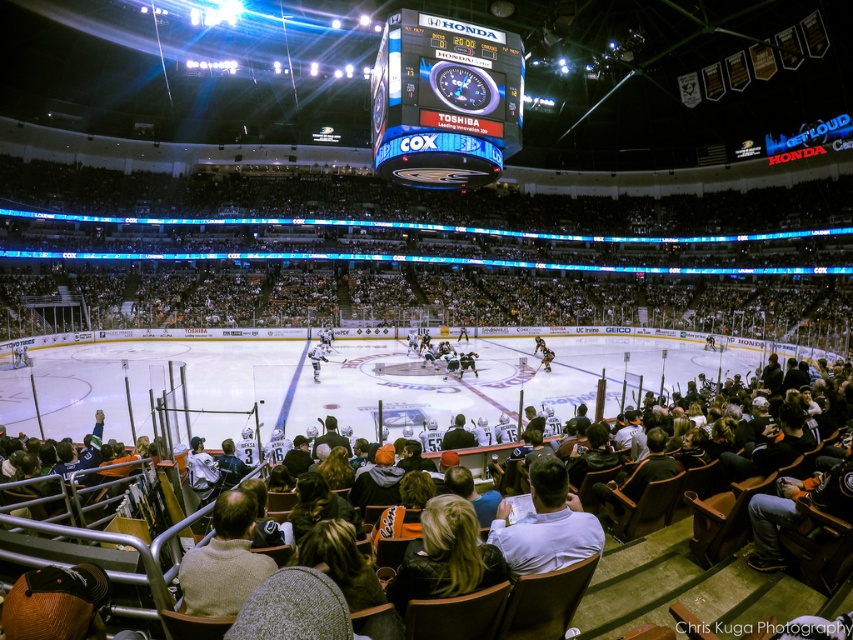
Does blue glossy scoreboard at upper center appear on the right side of white shirt at center?

In fact, blue glossy scoreboard at upper center is to the left of white shirt at center.

Is blue glossy scoreboard at upper center further to camera compared to white shirt at center?

That is True.

This screenshot has height=640, width=853. What do you see at coordinates (444, 100) in the screenshot? I see `blue glossy scoreboard at upper center` at bounding box center [444, 100].

I want to click on blue glossy scoreboard at upper center, so click(444, 100).

Who is more forward, (x=386, y=164) or (x=544, y=360)?

Point (x=386, y=164) is in front.

Is blue glossy scoreboard at upper center bigger than white jersey hockey player at center?

Correct, blue glossy scoreboard at upper center is larger in size than white jersey hockey player at center.

The width and height of the screenshot is (853, 640). Find the location of `blue glossy scoreboard at upper center`. blue glossy scoreboard at upper center is located at coordinates (444, 100).

At what (x,y) coordinates should I click in order to perform the action: click on blue glossy scoreboard at upper center. Please return your answer as a coordinate pair (x, y). Looking at the image, I should click on (444, 100).

Is point (242, 595) in front of point (438, 356)?

Yes, it is.

Who is higher up, beige sweater at lower center or white matte jersey at center?

white matte jersey at center

The image size is (853, 640). I want to click on beige sweater at lower center, so click(x=224, y=560).

Where is `beige sweater at lower center`? The width and height of the screenshot is (853, 640). beige sweater at lower center is located at coordinates point(224,560).